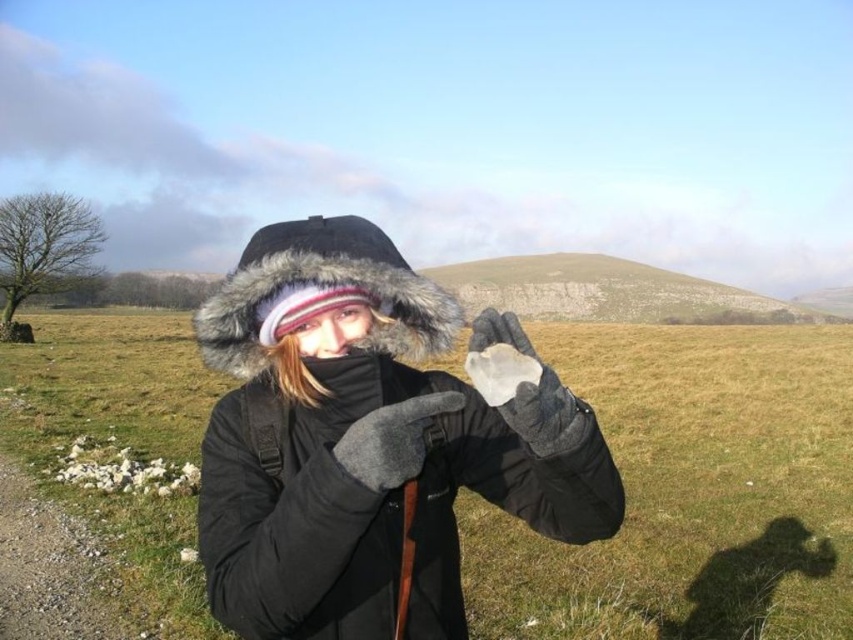
Looking at this image, you are a photographer trying to capture both points in the image. Which point, point (747, 464) or point (277, 236), is closer to the camera?

Point (277, 236) is closer to the camera because point (747, 464) is further away.

You are a geologist examining the scene. You notice two objects in the person hands. The transparent glass rock at center and the translucent glass at center. Which one is positioned more to the left?

The transparent glass rock at center is positioned to the left of the translucent glass at center, so it is more to the left.